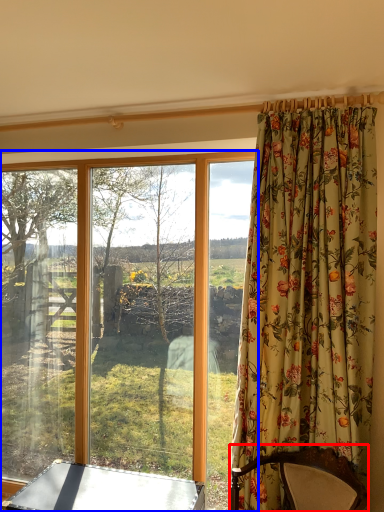
Question: Among these objects, which one is nearest to the camera, furniture (highlighted by a red box) or window (highlighted by a blue box)?

Choices:
 (A) furniture
 (B) window

Answer: (A)